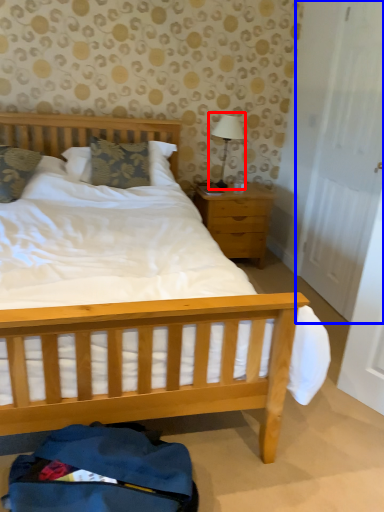
Question: Which of the following is the closest to the observer, table lamp (highlighted by a red box) or door (highlighted by a blue box)?

Choices:
 (A) table lamp
 (B) door

Answer: (B)